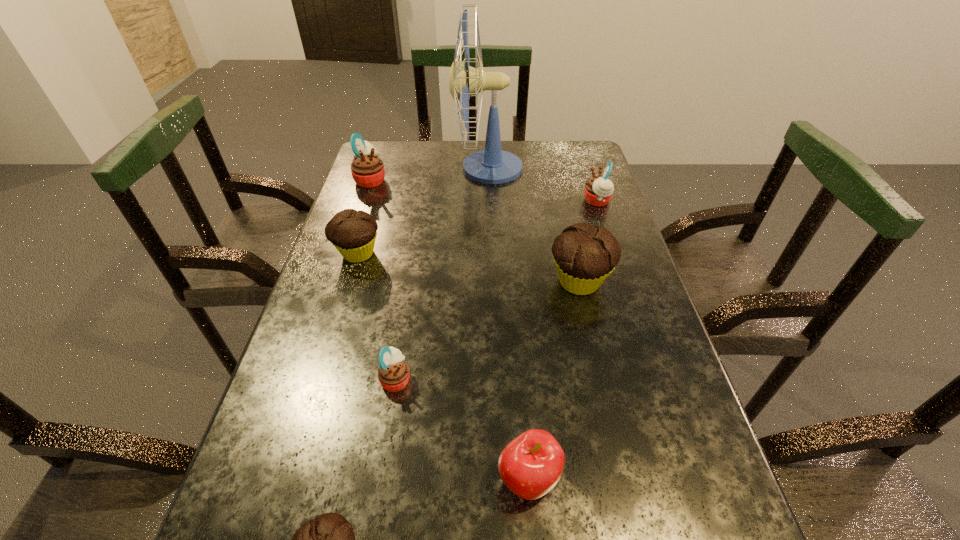
Where is `fan`? This screenshot has width=960, height=540. fan is located at coordinates (492, 165).

Image resolution: width=960 pixels, height=540 pixels. Identify the location of the tallest object. (492, 165).

Locate an element on the screen. the biggest pink muffin is located at coordinates pos(367,169).

The height and width of the screenshot is (540, 960). Identify the location of the farthest pink muffin. (367, 169).

Where is `the rightmost chocolate muffin`? This screenshot has height=540, width=960. the rightmost chocolate muffin is located at coordinates (584, 256).

Image resolution: width=960 pixels, height=540 pixels. I want to click on the fifth nearest muffin, so click(598, 190).

Identify the location of the rightmost pink muffin. The image size is (960, 540). (598, 190).

The image size is (960, 540). Identify the location of the second smallest chocolate muffin. (353, 233).

Identify the location of the second nearest object. The width and height of the screenshot is (960, 540). (530, 466).

At what (x,y) coordinates should I click in order to perform the action: click on apple. Please return your answer as a coordinate pair (x, y). This screenshot has height=540, width=960. Looking at the image, I should click on (530, 466).